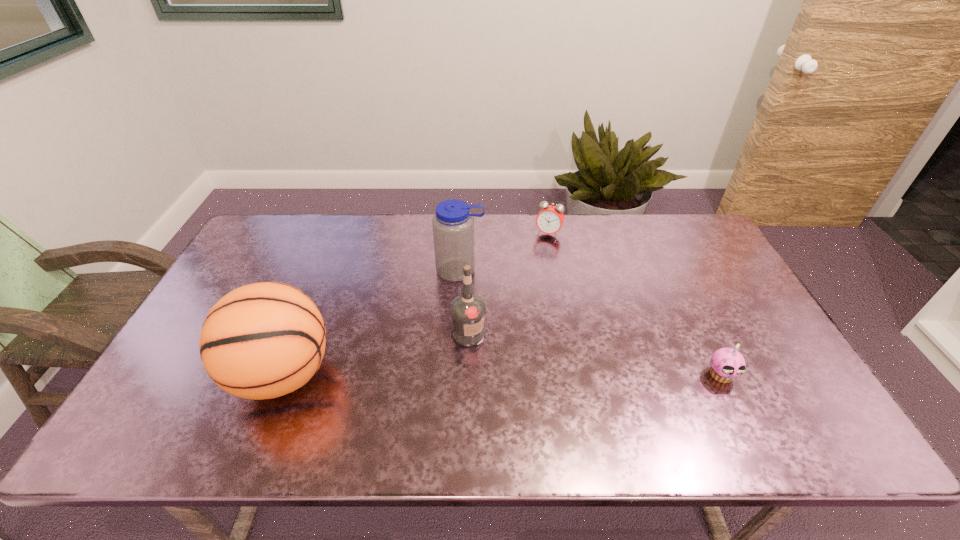
This screenshot has height=540, width=960. In order to click on vacant space on the desktop that is between the leftmost object and the rightmost object and is positioned on the front label of the vodka in this screenshot , I will do `click(540, 375)`.

Locate an element on the screen. The image size is (960, 540). vacant spot on the desktop that is between the basketball and the rightmost object and is positioned on the front-facing side of the farthest object is located at coordinates (490, 375).

Identify the location of vacant space on the desktop that is between the leftmost object and the rightmost object and is positioned with a carrying loop on the side of the fourth nearest object. [x=446, y=374].